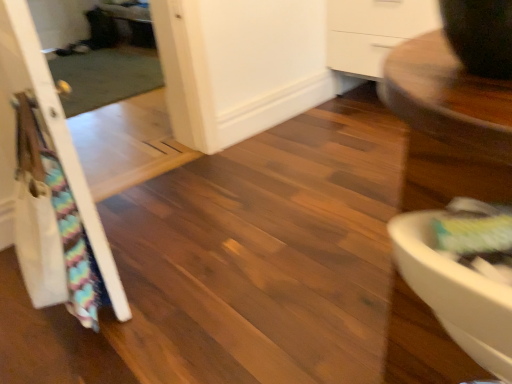
Question: Is white matte screen door at center far away from white wood door at left?

Choices:
 (A) yes
 (B) no

Answer: (A)

Question: Considering the relative sizes of white matte screen door at center and white wood door at left in the image provided, is white matte screen door at center bigger than white wood door at left?

Choices:
 (A) no
 (B) yes

Answer: (B)

Question: Is white wood door at left at the back of white matte screen door at center?

Choices:
 (A) no
 (B) yes

Answer: (A)

Question: Can you confirm if white matte screen door at center is thinner than white wood door at left?

Choices:
 (A) no
 (B) yes

Answer: (A)

Question: Is white matte screen door at center taller than white wood door at left?

Choices:
 (A) yes
 (B) no

Answer: (B)

Question: From a real-world perspective, is white matte screen door at center below white wood door at left?

Choices:
 (A) yes
 (B) no

Answer: (A)

Question: Considering the relative sizes of white wood door at left and white matte screen door at center in the image provided, is white wood door at left wider than white matte screen door at center?

Choices:
 (A) yes
 (B) no

Answer: (B)

Question: Is white matte screen door at center at the back of white wood door at left?

Choices:
 (A) no
 (B) yes

Answer: (A)

Question: Does white wood door at left come behind white matte screen door at center?

Choices:
 (A) yes
 (B) no

Answer: (B)

Question: Would you say white matte screen door at center is part of white wood door at left's contents?

Choices:
 (A) yes
 (B) no

Answer: (B)

Question: Does white wood door at left have a lesser width compared to white matte screen door at center?

Choices:
 (A) no
 (B) yes

Answer: (B)

Question: Are white wood door at left and white matte screen door at center making contact?

Choices:
 (A) no
 (B) yes

Answer: (A)

Question: Do you think white matte screen door at center is within white wood door at left, or outside of it?

Choices:
 (A) outside
 (B) inside

Answer: (A)